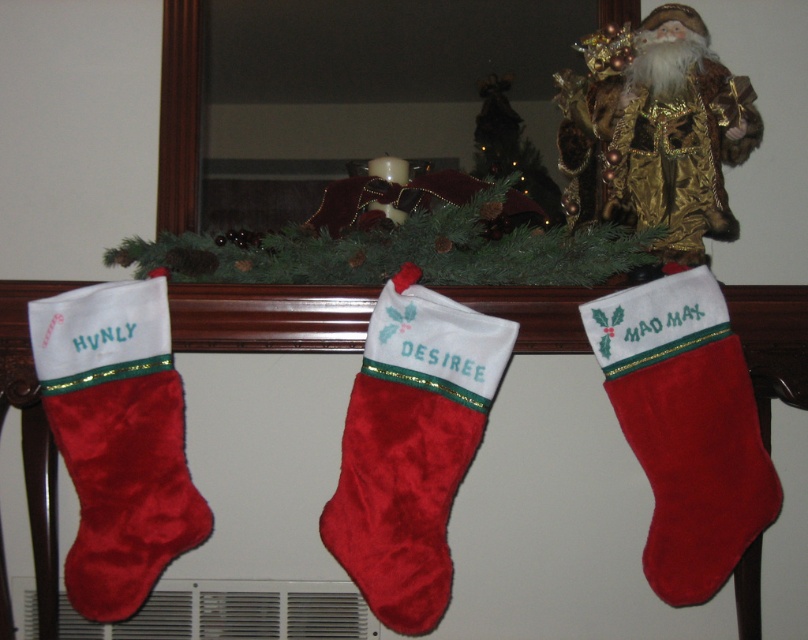
Question: Considering the real-world distances, which object is closest to the velvet red stocking at left?

Choices:
 (A) velvet red stocking at center
 (B) velvet red stocking at right

Answer: (A)

Question: From the image, what is the correct spatial relationship of velvet red stocking at left in relation to velvet red stocking at right?

Choices:
 (A) above
 (B) below

Answer: (B)

Question: Is velvet red stocking at left further to the viewer compared to velvet red stocking at right?

Choices:
 (A) yes
 (B) no

Answer: (B)

Question: Which of the following is the farthest from the observer?

Choices:
 (A) (93, 362)
 (B) (478, 360)
 (C) (724, 472)

Answer: (C)

Question: Which object appears farthest from the camera in this image?

Choices:
 (A) velvet red stocking at center
 (B) velvet red stocking at left

Answer: (B)

Question: Can you confirm if velvet red stocking at left is wider than velvet red stocking at right?

Choices:
 (A) no
 (B) yes

Answer: (A)